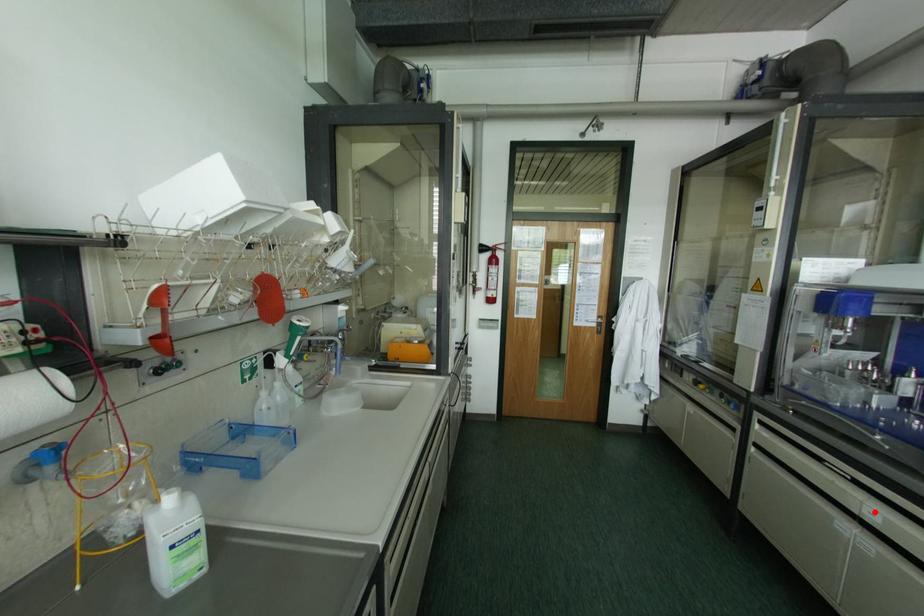
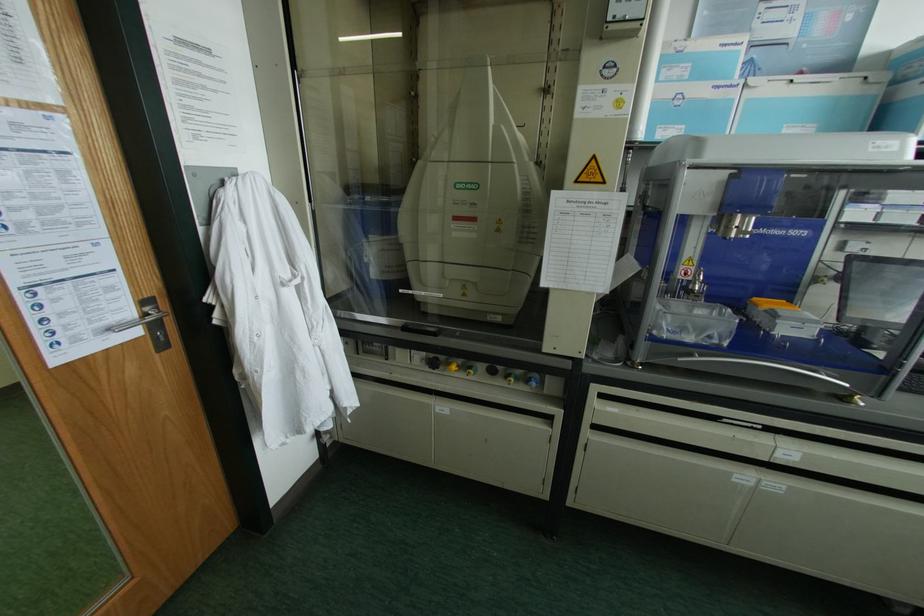
Find the pixel in the second image that matches the highlighted location in the first image.

(789, 451)